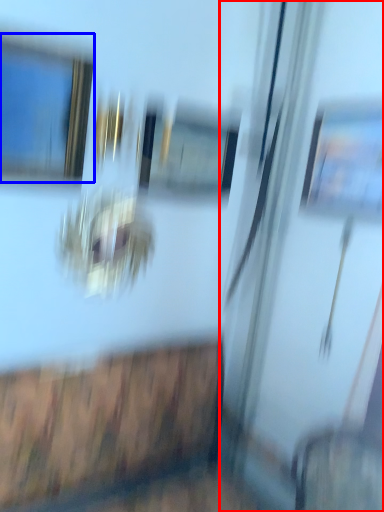
Question: Which object appears closest to the camera in this image, screen door (highlighted by a red box) or window (highlighted by a blue box)?

Choices:
 (A) screen door
 (B) window

Answer: (B)